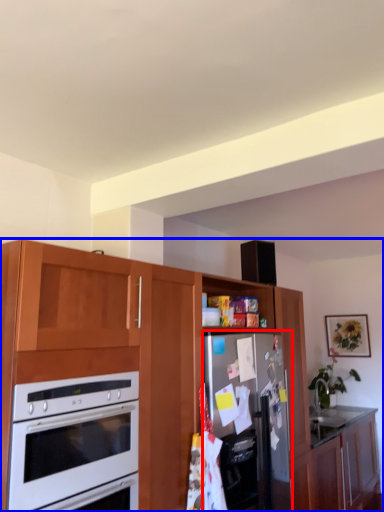
Question: Which point is closer to the camera, refrigerator (highlighted by a red box) or cabinetry (highlighted by a blue box)?

Choices:
 (A) refrigerator
 (B) cabinetry

Answer: (B)